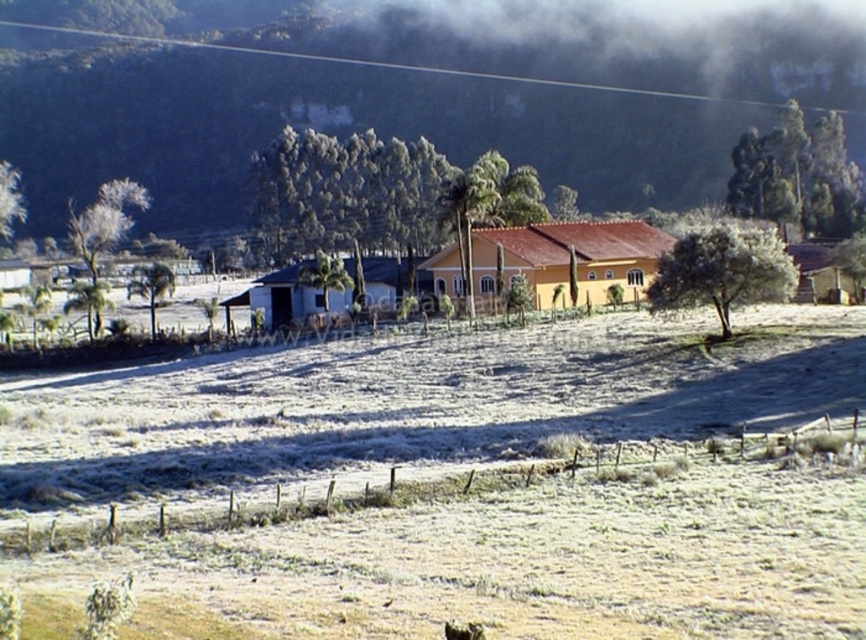
From the picture: You are a farmer planning to plant crops in the white frosty field at center and the green matte hillside at center. Which area has more space available for planting?

The green matte hillside at center has more space available for planting since it is larger than the white frosty field at center.

You are standing in the fenced area with grass and frost in front of the yellow house. You need to reach the green matte hillside at center. According to the coordinates provided, is the hillside directly in front of you or to one side?

The green matte hillside at center is located at point (410, 93), which means it is positioned to the left and slightly forward from your current position in the fenced area. Therefore, it is not directly in front but to the left side.